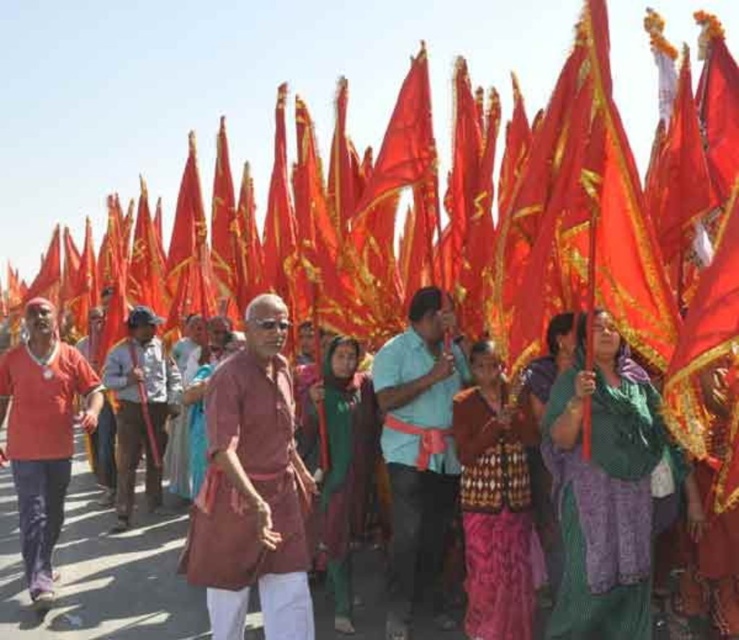
Question: Considering the real-world distances, which object is farthest from the matte red shirt at left?

Choices:
 (A) brown leather cap at center
 (B) patterned fabric sari at center
 (C) maroon fabric kurta at center
 (D) green woven cloth at center

Answer: (D)

Question: Is green woven cloth at center further to camera compared to brown leather cap at center?

Choices:
 (A) no
 (B) yes

Answer: (A)

Question: Is maroon fabric kurta at center bigger than brown leather cap at center?

Choices:
 (A) no
 (B) yes

Answer: (B)

Question: Is maroon fabric kurta at center in front of matte red shirt at left?

Choices:
 (A) yes
 (B) no

Answer: (A)

Question: Which object appears farthest from the camera in this image?

Choices:
 (A) teal fabric shirt at center
 (B) silky red fabric at center

Answer: (B)

Question: Which object appears closest to the camera in this image?

Choices:
 (A) silky red fabric at center
 (B) maroon fabric kurta at center
 (C) brown leather cap at center

Answer: (B)